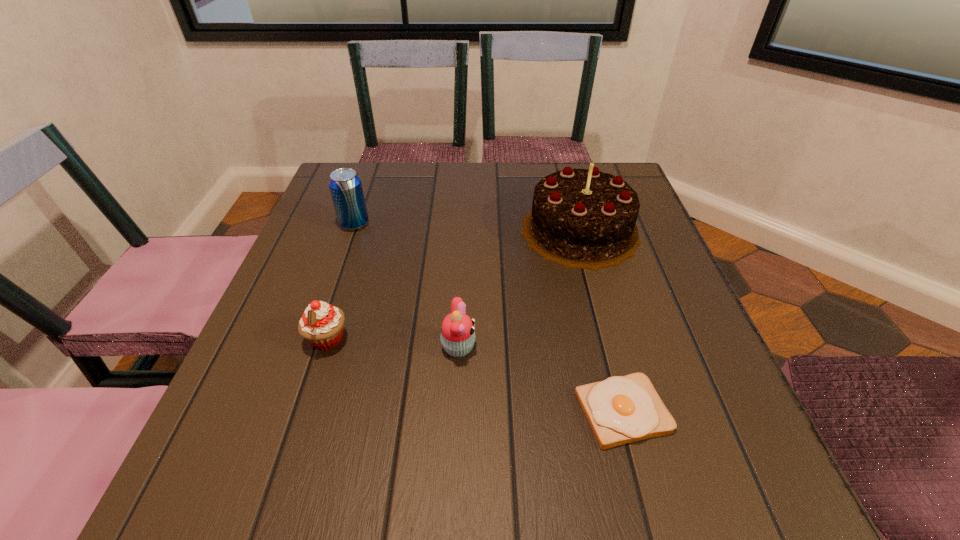
The image size is (960, 540). Identify the location of birthday cake. (580, 218).

The width and height of the screenshot is (960, 540). I want to click on beer can, so click(345, 185).

You are a GUI agent. You are given a task and a screenshot of the screen. Output one action in this format:
    pyautogui.click(x=<x>, y=<y>)
    Task: Click on the left cupcake
    The height and width of the screenshot is (540, 960).
    Given the screenshot: What is the action you would take?
    pyautogui.click(x=321, y=324)

Locate an element on the screen. This screenshot has width=960, height=540. the right cupcake is located at coordinates (457, 336).

Where is `toast`? This screenshot has width=960, height=540. toast is located at coordinates (621, 409).

Locate an element on the screen. Image resolution: width=960 pixels, height=540 pixels. the shortest object is located at coordinates pos(621,409).

At what (x,y) coordinates should I click in order to perform the action: click on free space located on the left of the tallest object. Please return your answer as a coordinate pair (x, y). The width and height of the screenshot is (960, 540). Looking at the image, I should click on (369, 231).

Where is `free space located on the front of the second tallest object`? free space located on the front of the second tallest object is located at coordinates (346, 249).

This screenshot has height=540, width=960. Identify the location of vacant space located on the right of the left cupcake. (440, 340).

Locate an element on the screen. The image size is (960, 540). free point located 0.100m on the face of the right cupcake is located at coordinates (533, 348).